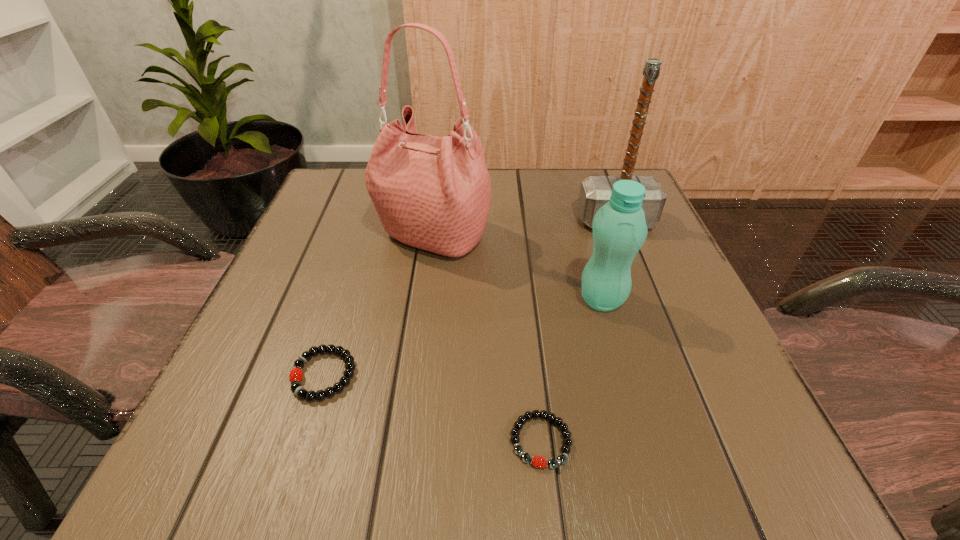
I want to click on handbag, so click(x=432, y=193).

Where is `hammer`? hammer is located at coordinates (595, 191).

At what (x,y) coordinates should I click in order to perform the action: click on the third tallest object. Please return your answer as a coordinate pair (x, y). The image size is (960, 540). Looking at the image, I should click on (619, 227).

Find the location of a particular element. the third farthest object is located at coordinates (619, 227).

This screenshot has width=960, height=540. Identify the location of the taller bracelet. (295, 376).

The height and width of the screenshot is (540, 960). Find the location of `the farther bracelet`. the farther bracelet is located at coordinates (295, 376).

Locate an element on the screen. The height and width of the screenshot is (540, 960). the third object from left to right is located at coordinates (536, 461).

Where is `the shortest object`? The height and width of the screenshot is (540, 960). the shortest object is located at coordinates (536, 461).

You are a GUI agent. You are given a task and a screenshot of the screen. Output one action in this format:
    pyautogui.click(x=<x>, y=<y>)
    Task: Click on the vacant space situated 0.100m on the left of the handbag
    This screenshot has height=540, width=960.
    Given the screenshot: What is the action you would take?
    pyautogui.click(x=328, y=236)

The width and height of the screenshot is (960, 540). What are the coordinates of `free space located on the striking surface of the fourth shortest object` in the screenshot? It's located at (636, 271).